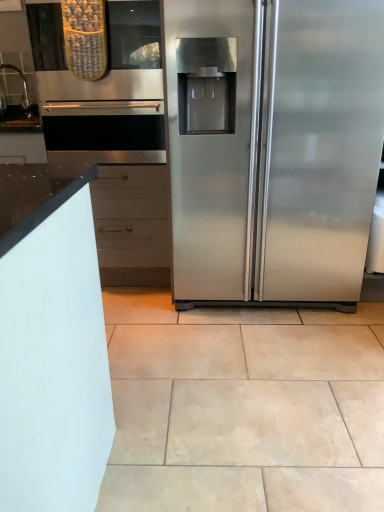
Question: Is satin nickel faucet at left facing away from beige ceramic tile at center?

Choices:
 (A) no
 (B) yes

Answer: (A)

Question: Considering the relative sizes of satin nickel faucet at left and beige ceramic tile at center in the image provided, is satin nickel faucet at left shorter than beige ceramic tile at center?

Choices:
 (A) no
 (B) yes

Answer: (A)

Question: From the image's perspective, would you say satin nickel faucet at left is shown under beige ceramic tile at center?

Choices:
 (A) no
 (B) yes

Answer: (A)

Question: Considering the relative positions of satin nickel faucet at left and beige ceramic tile at center in the image provided, is satin nickel faucet at left behind beige ceramic tile at center?

Choices:
 (A) yes
 (B) no

Answer: (A)

Question: Is satin nickel faucet at left positioned beyond the bounds of beige ceramic tile at center?

Choices:
 (A) no
 (B) yes

Answer: (B)

Question: From the image's perspective, is beige ceramic tile at center above or below satin nickel faucet at left?

Choices:
 (A) below
 (B) above

Answer: (A)

Question: Considering the relative positions of beige ceramic tile at center and satin nickel faucet at left in the image provided, is beige ceramic tile at center to the left or to the right of satin nickel faucet at left?

Choices:
 (A) right
 (B) left

Answer: (A)

Question: In terms of height, does beige ceramic tile at center look taller or shorter compared to satin nickel faucet at left?

Choices:
 (A) short
 (B) tall

Answer: (A)

Question: From a real-world perspective, is beige ceramic tile at center positioned above or below satin nickel faucet at left?

Choices:
 (A) below
 (B) above

Answer: (A)

Question: Looking at their shapes, would you say stainless steel refrigerator at right is wider or thinner than satin nickel faucet at left?

Choices:
 (A) wide
 (B) thin

Answer: (A)

Question: Is stainless steel refrigerator at right bigger or smaller than satin nickel faucet at left?

Choices:
 (A) small
 (B) big

Answer: (B)

Question: Considering the positions of stainless steel refrigerator at right and satin nickel faucet at left in the image, is stainless steel refrigerator at right taller or shorter than satin nickel faucet at left?

Choices:
 (A) short
 (B) tall

Answer: (B)

Question: Do you think stainless steel refrigerator at right is within satin nickel faucet at left, or outside of it?

Choices:
 (A) inside
 (B) outside

Answer: (B)

Question: Does point (208, 119) appear closer or farther from the camera than point (195, 460)?

Choices:
 (A) farther
 (B) closer

Answer: (A)

Question: From the image's perspective, is stainless steel refrigerator at right positioned above or below beige ceramic tile at center?

Choices:
 (A) below
 (B) above

Answer: (B)